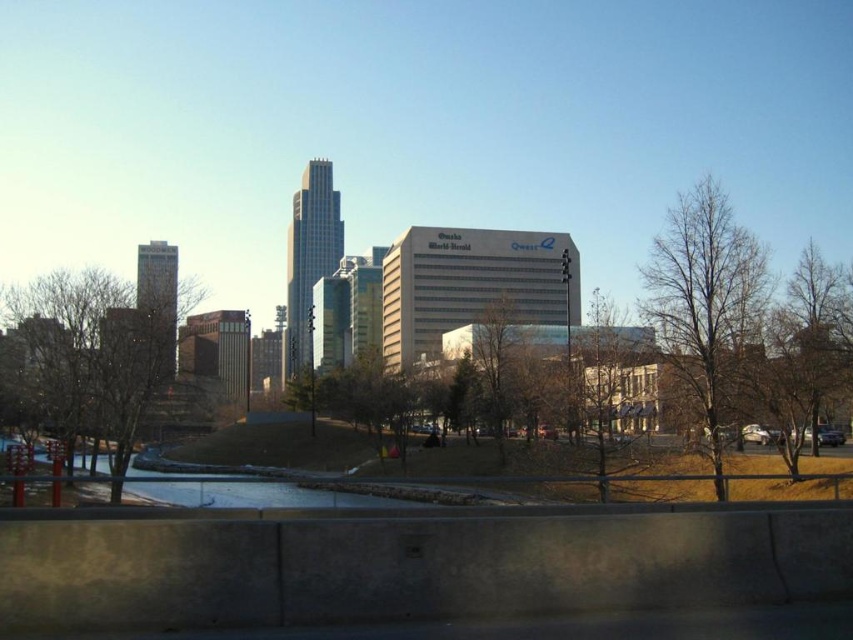
Question: Which of the following is the closest to the observer?

Choices:
 (A) bare wood tree at center
 (B) green leafy tree at center
 (C) bare branches at left

Answer: (C)

Question: Which is farther from the green leafy tree at center?

Choices:
 (A) bare branches at left
 (B) bare wood tree at center
 (C) bare branches at right

Answer: (A)

Question: Does bare branches at left come in front of green leafy tree at center?

Choices:
 (A) no
 (B) yes

Answer: (B)

Question: Can you confirm if bare branches at left is positioned below green leafy tree at center?

Choices:
 (A) no
 (B) yes

Answer: (A)

Question: Which point is farther to the camera?

Choices:
 (A) (490, 416)
 (B) (113, 342)

Answer: (A)

Question: Can you confirm if bare branches at right is wider than bare wood tree at center?

Choices:
 (A) yes
 (B) no

Answer: (A)